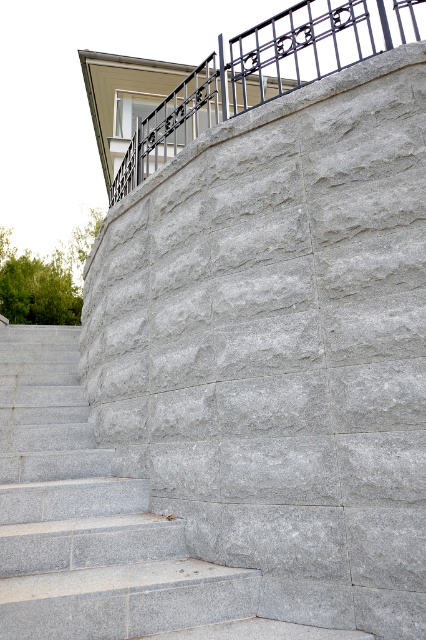
In the scene shown: You are standing at the base of the gray stone stairs at center. If you walk straight ahead, will you reach the stone retaining wall shown in the scene?

Yes, because the gray stone stairs at center lead directly up to the stone retaining wall.

You are carrying a large box and need to walk up the gray stone stairs at center while holding onto the black wrought iron railing at upper center. Will the railing be wide enough for you to grip comfortably?

The gray stone stairs at center is wider than the black wrought iron railing at upper center, so the railing may not be wide enough to grip comfortably while ascending the stairs.

You are standing at the base of the gray stone stairs at center and want to reach the black wrought iron railing at upper center. Which direction should you move to get closer to the railing?

You should move upwards along the gray stone stairs at center to get closer to the black wrought iron railing at upper center since the stairs are closer to you and lead upward toward the railing.